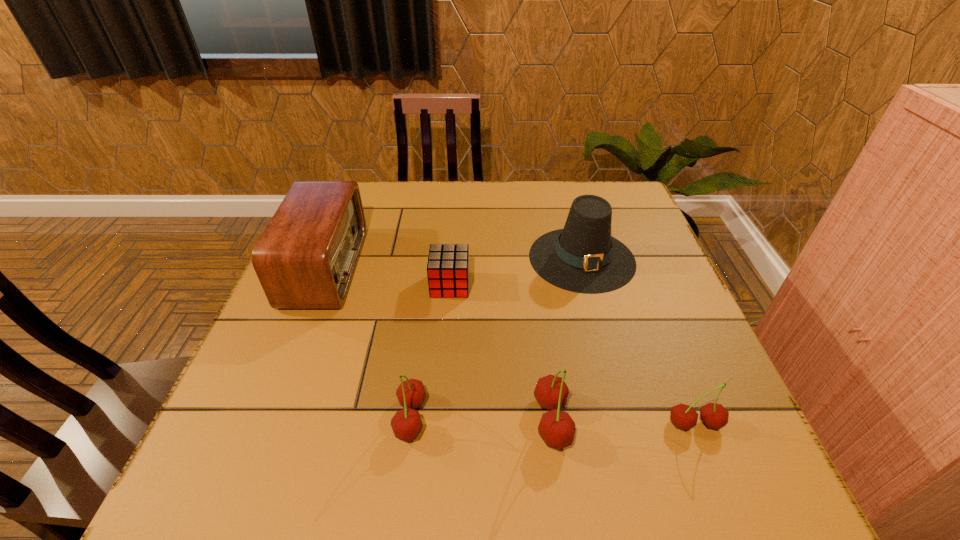
Where is `vacant space that's between the leftmost cherry and the leftmost object`? vacant space that's between the leftmost cherry and the leftmost object is located at coordinates (x=369, y=343).

You are a GUI agent. You are given a task and a screenshot of the screen. Output one action in this format:
    pyautogui.click(x=<x>, y=<y>)
    Task: Click on the vacant area between the second shortest cherry and the second cherry from right to left
    This screenshot has height=540, width=960.
    Given the screenshot: What is the action you would take?
    pyautogui.click(x=481, y=420)

Select which object appears as the third closest to the leftmost cherry. Please provide its 2D coordinates. Your answer should be formatted as a tuple, i.e. [(x, y)], where the tuple contains the x and y coordinates of a point satisfying the conditions above.

[(305, 259)]

Select which object appears as the third closest to the hat. Please provide its 2D coordinates. Your answer should be formatted as a tuple, i.e. [(x, y)], where the tuple contains the x and y coordinates of a point satisfying the conditions above.

[(713, 415)]

Identify which cherry is located as the nearest to the hat. Please provide its 2D coordinates. Your answer should be formatted as a tuple, i.e. [(x, y)], where the tuple contains the x and y coordinates of a point satisfying the conditions above.

[(557, 429)]

Choose which cherry is the second nearest neighbor to the second cherry from right to left. Please provide its 2D coordinates. Your answer should be formatted as a tuple, i.e. [(x, y)], where the tuple contains the x and y coordinates of a point satisfying the conditions above.

[(406, 424)]

This screenshot has width=960, height=540. What are the coordinates of `free space that satisfies the following two spatial constraints: 1. on the front panel of the leftmost object; 2. on the left side of the shortest object` in the screenshot? It's located at (319, 285).

Where is `vacant region that satisfies the following two spatial constraints: 1. on the back side of the shortest object; 2. on the front panel of the leftmost object`? This screenshot has width=960, height=540. vacant region that satisfies the following two spatial constraints: 1. on the back side of the shortest object; 2. on the front panel of the leftmost object is located at coordinates (451, 268).

This screenshot has width=960, height=540. Identify the location of blank area in the image that satisfies the following two spatial constraints: 1. on the front panel of the leftmost object; 2. on the left side of the cube. (319, 285).

Find the location of a particular element. This screenshot has height=540, width=960. free space that satisfies the following two spatial constraints: 1. on the front-facing side of the hat; 2. on the surface of the second cherry from left to right is located at coordinates (626, 421).